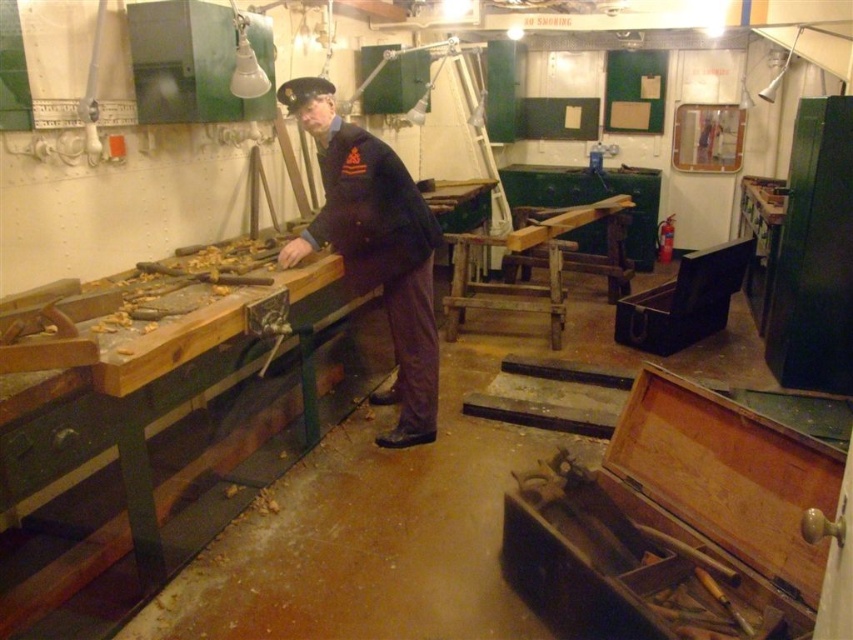
Question: Can you confirm if dark blue uniform at center is positioned to the right of black fabric cap at upper center?

Choices:
 (A) no
 (B) yes

Answer: (B)

Question: From the image, what is the correct spatial relationship of dark blue uniform at center in relation to black fabric cap at upper center?

Choices:
 (A) below
 (B) above

Answer: (A)

Question: Which point is closer to the camera?

Choices:
 (A) (416, 250)
 (B) (288, 99)

Answer: (B)

Question: Does dark blue uniform at center lie behind black fabric cap at upper center?

Choices:
 (A) no
 (B) yes

Answer: (A)